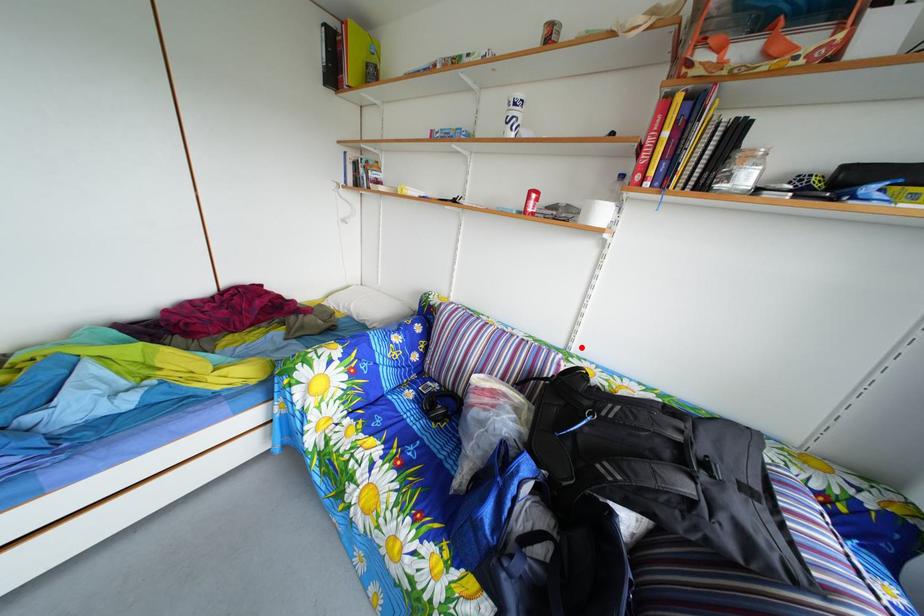
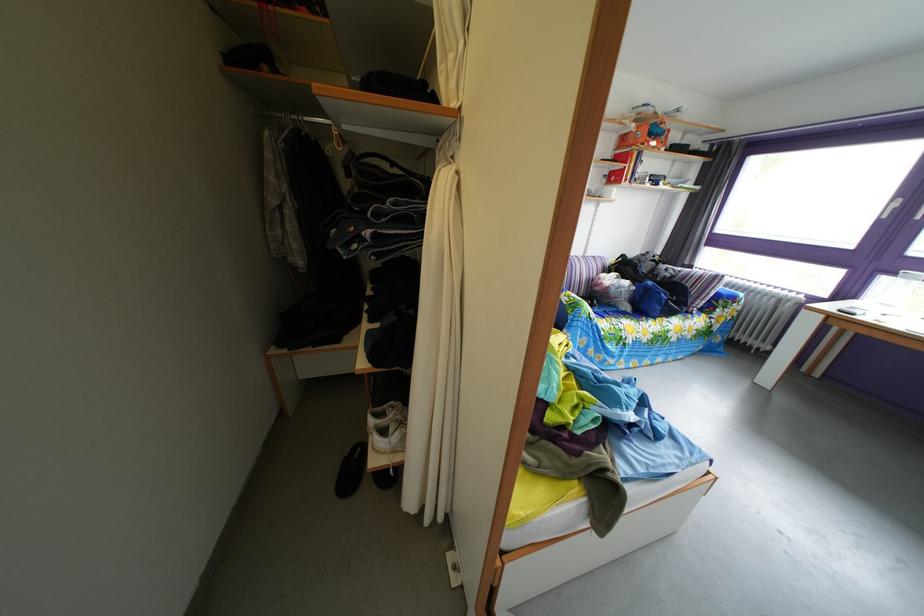
Find the pixel in the second image that matches the highlighted location in the first image.

(596, 261)